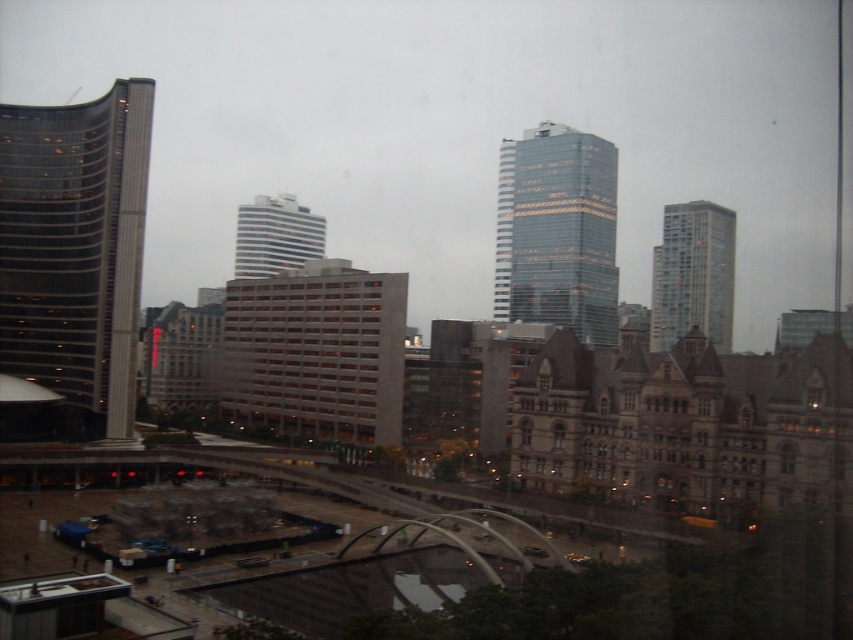
In the scene shown: You are an architect analyzing the city layout. Based on the scene, which skyscraper is positioned lower in the image, the glassy reflective skyscraper at left or the shiny glass skyscraper at center?

The glassy reflective skyscraper at left is located below the shiny glass skyscraper at center, so it is positioned lower in the image.